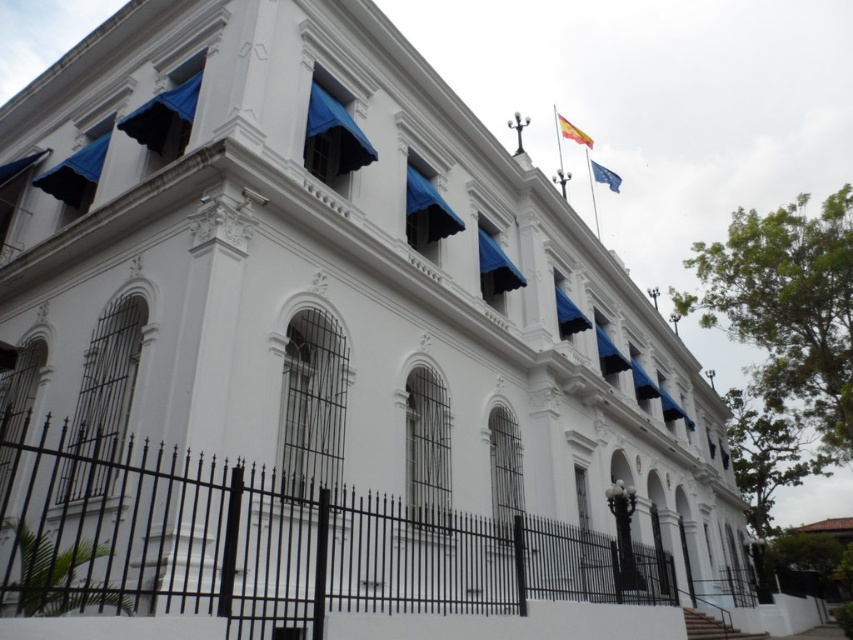
From the picture: You are standing in front of the grand white colonial building and want to take a photo of the black wrought iron fence at lower center. According to the coordinates provided, where exactly should you position yourself to capture the fence in the center of your photo?

To capture the black wrought iron fence at lower center in the center of your photo, position yourself directly at the coordinates point [271,541].

You are standing at the point marked as point (569,128). You want to take a photo of the grand white colonial building with the black wrought iron fence in the foreground. Will you be able to capture both the building and the fence in the same frame?

The point (569,128) is 112.30 feet away from the viewer. Since the building and fence are both within this distance, they can be captured in the same frame.